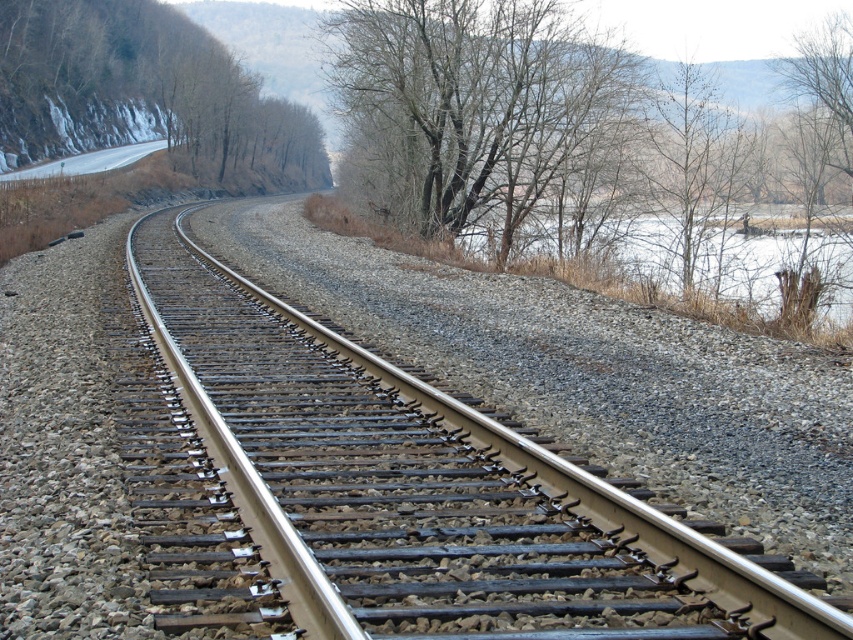
Is bare branches at upper center closer to camera compared to gray gravel lake at upper right?

No, bare branches at upper center is behind gray gravel lake at upper right.

Does bare branches at upper center appear on the left side of gray gravel lake at upper right?

Correct, you'll find bare branches at upper center to the left of gray gravel lake at upper right.

Who is more forward, (392, 74) or (836, 328)?

Point (836, 328)

Locate an element on the screen. The height and width of the screenshot is (640, 853). bare branches at upper center is located at coordinates (468, 106).

Between metal/smooth track at center and bare wood trees at upper left, which one appears on the left side from the viewer's perspective?

bare wood trees at upper left

Between metal/smooth track at center and bare wood trees at upper left, which one appears on the right side from the viewer's perspective?

metal/smooth track at center is more to the right.

The width and height of the screenshot is (853, 640). I want to click on metal/smooth track at center, so click(x=428, y=488).

Which is above, metal/smooth track at center or gray gravel lake at upper right?

Positioned higher is gray gravel lake at upper right.

Consider the image. Between metal/smooth track at center and gray gravel lake at upper right, which one has less height?

With less height is metal/smooth track at center.

This screenshot has height=640, width=853. Identify the location of metal/smooth track at center. (428, 488).